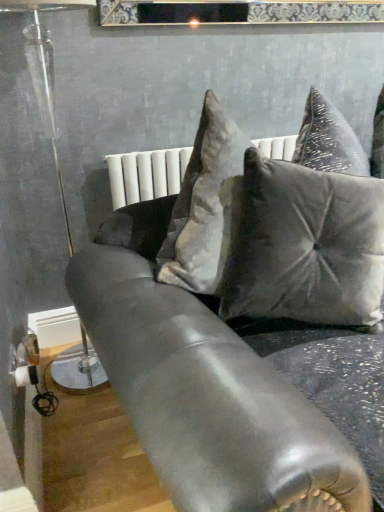
I want to click on satin black couch at center, so click(x=238, y=313).

Does clear glass lamp at left appear on the left side of satin gray pillow at center?

Yes, clear glass lamp at left is to the left of satin gray pillow at center.

Which is behind, point (69, 3) or point (229, 306)?

Point (69, 3)

What's the angular difference between clear glass lamp at left and satin gray pillow at center's facing directions?

The angular difference between clear glass lamp at left and satin gray pillow at center is 10.1 degrees.

Is clear glass lamp at left aimed at satin gray pillow at center?

No, clear glass lamp at left is not facing towards satin gray pillow at center.

Which of these two, satin gray pillow at center or clear glass lamp at left, stands taller?

clear glass lamp at left is taller.

Which is more to the right, satin gray pillow at center or clear glass lamp at left?

From the viewer's perspective, satin gray pillow at center appears more on the right side.

Relative to clear glass lamp at left, is satin gray pillow at center in front or behind?

satin gray pillow at center is in front of clear glass lamp at left.

Which of these two, satin gray pillow at center or satin black couch at center, is bigger?

With larger size is satin black couch at center.

Is satin gray pillow at center surrounding satin black couch at center?

No, satin black couch at center is not a part of satin gray pillow at center.

Looking at this image, is satin gray pillow at center to the right of satin black couch at center from the viewer's perspective?

Incorrect, satin gray pillow at center is not on the right side of satin black couch at center.

Who is shorter, satin gray pillow at center or satin black couch at center?

Standing shorter between the two is satin gray pillow at center.

At what (x,y) coordinates should I click in order to perform the action: click on lamp behind the satin black couch at center. Please return your answer as a coordinate pair (x, y). Image resolution: width=384 pixels, height=512 pixels. Looking at the image, I should click on (42, 88).

Are satin black couch at center and clear glass lamp at left beside each other?

No, satin black couch at center is not next to clear glass lamp at left.

From the picture: Is clear glass lamp at left at the back of satin black couch at center?

Correct, satin black couch at center is looking away from clear glass lamp at left.

Between satin black couch at center and clear glass lamp at left, which one is positioned in front?

satin black couch at center is more forward.

Does clear glass lamp at left contain satin black couch at center?

No, satin black couch at center is located outside of clear glass lamp at left.

Considering the relative sizes of clear glass lamp at left and satin black couch at center in the image provided, is clear glass lamp at left wider than satin black couch at center?

Incorrect, the width of clear glass lamp at left does not surpass that of satin black couch at center.

In terms of height, does clear glass lamp at left look taller or shorter compared to satin black couch at center?

In the image, clear glass lamp at left appears to be taller than satin black couch at center.

Can we say satin black couch at center lies outside satin gray pillow at center?

satin black couch at center is positioned outside satin gray pillow at center.

From the picture: Is satin black couch at center wider than satin gray pillow at center?

Yes.

Between satin black couch at center and satin gray pillow at center, which one has smaller size?

satin gray pillow at center.

What are the coordinates of `pillow that appears behind the satin black couch at center` in the screenshot? It's located at (306, 246).

Identify the location of lamp below the satin gray pillow at center (from a real-world perspective). The width and height of the screenshot is (384, 512). (42, 88).

This screenshot has width=384, height=512. In order to click on lamp lying behind the satin gray pillow at center in this screenshot , I will do `click(42, 88)`.

From the image, which object appears to be nearer to satin gray pillow at center, clear glass lamp at left or satin black couch at center?

Among the two, satin black couch at center is located nearer to satin gray pillow at center.

Which object lies further to the anchor point satin black couch at center, satin gray pillow at center or clear glass lamp at left?

clear glass lamp at left is further to satin black couch at center.

Looking at the image, which one is located closer to clear glass lamp at left, satin black couch at center or satin gray pillow at center?

satin black couch at center lies closer to clear glass lamp at left than the other object.

When comparing their distances from satin gray pillow at center, does satin black couch at center or clear glass lamp at left seem closer?

The object closer to satin gray pillow at center is satin black couch at center.

Which object lies nearer to the anchor point satin black couch at center, clear glass lamp at left or satin gray pillow at center?

satin gray pillow at center lies closer to satin black couch at center than the other object.

Which object lies nearer to the anchor point clear glass lamp at left, satin gray pillow at center or satin black couch at center?

satin black couch at center lies closer to clear glass lamp at left than the other object.

Find the location of a particular element. The image size is (384, 512). pillow between clear glass lamp at left and satin black couch at center from left to right is located at coordinates (306, 246).